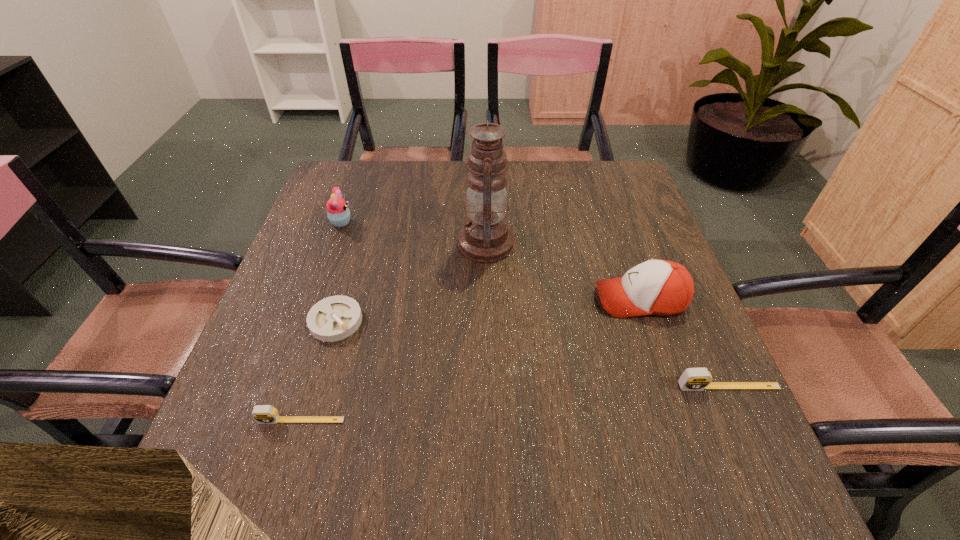
Find the location of a particular element. This screenshot has height=540, width=960. tape measure that is at the right edge is located at coordinates (693, 379).

Where is `baseball cap positioned at the right edge`? The width and height of the screenshot is (960, 540). baseball cap positioned at the right edge is located at coordinates (659, 287).

Identify the location of object that is at the near left corner. Image resolution: width=960 pixels, height=540 pixels. pos(263,414).

Where is `free point at the far edge`? free point at the far edge is located at coordinates (385, 187).

The width and height of the screenshot is (960, 540). In the image, there is a desktop. In order to click on vacant area at the near edge in this screenshot , I will do `click(392, 418)`.

The image size is (960, 540). In order to click on vacant space at the left edge of the desktop in this screenshot , I will do `click(372, 207)`.

Image resolution: width=960 pixels, height=540 pixels. In the image, there is a desktop. Find the location of `vacant region at the right edge`. vacant region at the right edge is located at coordinates (651, 218).

The height and width of the screenshot is (540, 960). In the image, there is a desktop. What are the coordinates of `vacant space at the far left corner` in the screenshot? It's located at [324, 196].

Locate an element on the screen. Image resolution: width=960 pixels, height=540 pixels. free space at the near left corner is located at coordinates (260, 428).

I want to click on vacant space at the far right corner of the desktop, so [x=609, y=177].